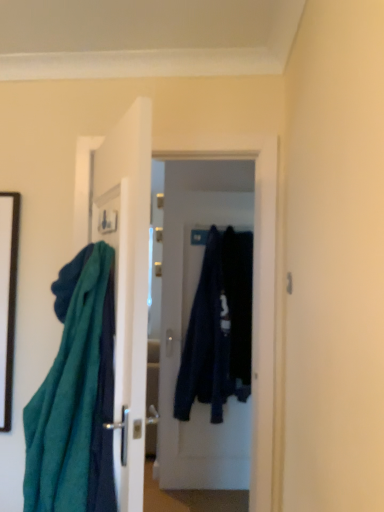
Locate an element on the screen. This screenshot has width=384, height=512. free point above dark blue fabric at center, positioned as the 1th door in back-to-front order (from a real-world perspective) is located at coordinates coord(209,192).